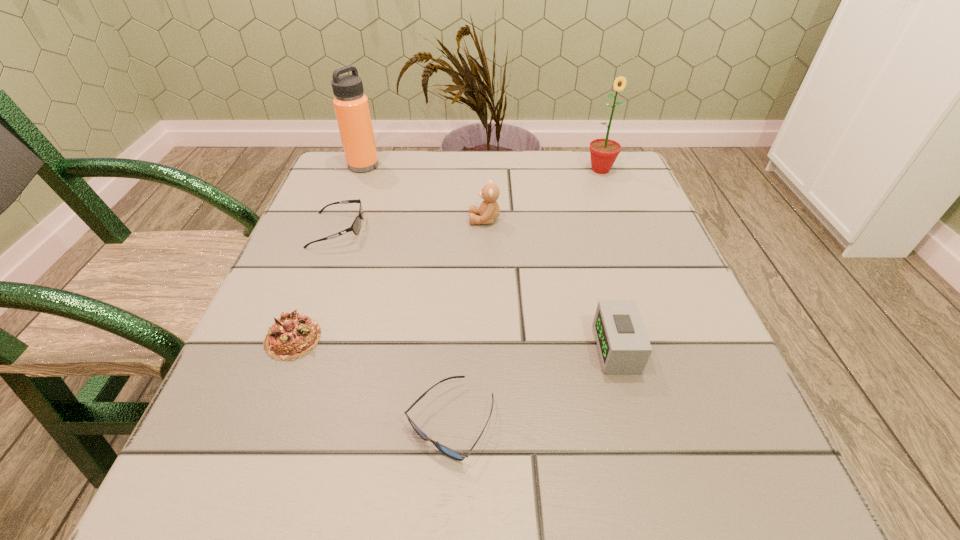
Locate an element on the screen. thermos bottle is located at coordinates [x=351, y=106].

Identify the location of the rightmost object. The width and height of the screenshot is (960, 540). (603, 152).

At what (x,y) coordinates should I click in order to perform the action: click on the third tallest object. Please return your answer as a coordinate pair (x, y). Looking at the image, I should click on (488, 211).

Image resolution: width=960 pixels, height=540 pixels. In order to click on the sixth object from left to right in this screenshot , I will do `click(624, 348)`.

Identify the location of alarm clock. (624, 348).

This screenshot has width=960, height=540. Find the location of `the left sunglasses`. the left sunglasses is located at coordinates (356, 225).

In order to click on the farther sunglasses in this screenshot , I will do `click(356, 225)`.

In order to click on chocolate cake in this screenshot , I will do `click(294, 334)`.

Locate an element on the screen. the nearest object is located at coordinates (456, 455).

Where is `the nearer sunglasses`? This screenshot has height=540, width=960. the nearer sunglasses is located at coordinates (456, 455).